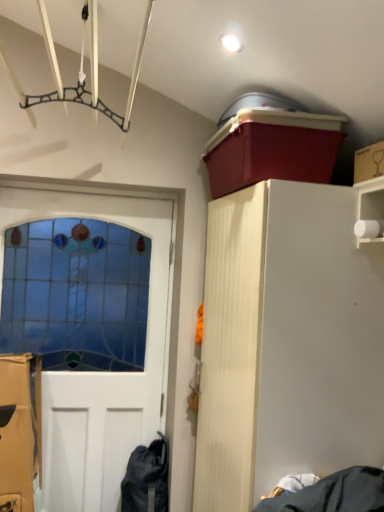
The height and width of the screenshot is (512, 384). I want to click on white wood cabinet at upper right, so click(287, 342).

Find the location of a particular element. door that is below the cardboard box at upper right (from the image's perspective) is located at coordinates (82, 341).

From the image's perspective, is stained glass door at left above or below cardboard box at upper right?

Clearly, from the image's perspective, stained glass door at left is below cardboard box at upper right.

Considering the positions of objects stained glass door at left and cardboard box at upper right in the image provided, who is in front, stained glass door at left or cardboard box at upper right?

cardboard box at upper right.

How much distance is there between stained glass door at left and cardboard box at upper right?

stained glass door at left is 1.44 meters away from cardboard box at upper right.

Looking at their sizes, would you say matte plastic storage bin at upper right is wider or thinner than white wood cabinet at upper right?

matte plastic storage bin at upper right is thinner than white wood cabinet at upper right.

In the image, is matte plastic storage bin at upper right on the left side or the right side of white wood cabinet at upper right?

In the image, matte plastic storage bin at upper right appears on the left side of white wood cabinet at upper right.

Locate an element on the screen. This screenshot has height=512, width=384. box above the white wood cabinet at upper right (from a real-world perspective) is located at coordinates (272, 149).

Are matte plastic storage bin at upper right and white wood cabinet at upper right beside each other?

No, matte plastic storage bin at upper right is not beside white wood cabinet at upper right.

Is cardboard box at upper right directly adjacent to stained glass door at left?

No, cardboard box at upper right is not next to stained glass door at left.

Does cardboard box at upper right turn towards stained glass door at left?

No, cardboard box at upper right is not aimed at stained glass door at left.

From a real-world perspective, is cardboard box at upper right located higher than stained glass door at left?

Correct, in the physical world, cardboard box at upper right is higher than stained glass door at left.

Does cardboard box at upper right have a lesser height compared to stained glass door at left?

Indeed, cardboard box at upper right has a lesser height compared to stained glass door at left.

From the picture: From the image's perspective, which one is positioned higher, white wood cabinet at upper right or matte plastic storage bin at upper right?

matte plastic storage bin at upper right.

Is white wood cabinet at upper right turned away from matte plastic storage bin at upper right?

No, white wood cabinet at upper right is not facing the opposite direction of matte plastic storage bin at upper right.

From the picture: From a real-world perspective, is white wood cabinet at upper right positioned under matte plastic storage bin at upper right based on gravity?

Yes, from a real-world perspective, white wood cabinet at upper right is beneath matte plastic storage bin at upper right.

How much distance is there between white wood cabinet at upper right and matte plastic storage bin at upper right?

A distance of 37.55 centimeters exists between white wood cabinet at upper right and matte plastic storage bin at upper right.

Can you confirm if cardboard box at upper right is bigger than matte plastic storage bin at upper right?

No, cardboard box at upper right is not bigger than matte plastic storage bin at upper right.

Where is `box above the cardboard box at upper right (from the image's perspective)`? This screenshot has height=512, width=384. box above the cardboard box at upper right (from the image's perspective) is located at coordinates (272, 149).

Could matte plastic storage bin at upper right be considered to be inside cardboard box at upper right?

No, matte plastic storage bin at upper right is not inside cardboard box at upper right.

Consider the image. Considering the sizes of objects cardboard box at upper right and matte plastic storage bin at upper right in the image provided, who is shorter, cardboard box at upper right or matte plastic storage bin at upper right?

cardboard box at upper right.

This screenshot has height=512, width=384. In order to click on cardboard box located on the right of white wood cabinet at upper right in this screenshot , I will do `click(369, 162)`.

Does point (366, 154) appear closer or farther from the camera than point (294, 243)?

Point (366, 154) is positioned farther from the camera compared to point (294, 243).

Would you say cardboard box at upper right is to the left or to the right of white wood cabinet at upper right in the picture?

From the image, it's evident that cardboard box at upper right is to the right of white wood cabinet at upper right.

Is stained glass door at left turned away from white wood cabinet at upper right?

No, stained glass door at left's orientation is not away from white wood cabinet at upper right.

Which is more to the left, stained glass door at left or white wood cabinet at upper right?

stained glass door at left is more to the left.

From a real-world perspective, is stained glass door at left physically below white wood cabinet at upper right?

Indeed, from a real-world perspective, stained glass door at left is positioned beneath white wood cabinet at upper right.

The height and width of the screenshot is (512, 384). I want to click on door that appears behind the cardboard box at upper right, so click(x=82, y=341).

Image resolution: width=384 pixels, height=512 pixels. Identify the location of box that appears above the white wood cabinet at upper right (from the image's perspective). (272, 149).

Based on their spatial positions, is cardboard box at upper right or white wood cabinet at upper right closer to matte plastic storage bin at upper right?

Among the two, cardboard box at upper right is located nearer to matte plastic storage bin at upper right.

Considering their positions, is white wood cabinet at upper right positioned further to cardboard box at upper right than stained glass door at left?

Based on the image, stained glass door at left appears to be further to cardboard box at upper right.

When comparing their distances from cardboard box at upper right, does white wood cabinet at upper right or matte plastic storage bin at upper right seem further?

white wood cabinet at upper right is positioned further to the anchor cardboard box at upper right.

When comparing their distances from stained glass door at left, does cardboard box at upper right or matte plastic storage bin at upper right seem further?

cardboard box at upper right lies further to stained glass door at left than the other object.

Based on their spatial positions, is stained glass door at left or cardboard box at upper right closer to matte plastic storage bin at upper right?

cardboard box at upper right.

From the image, which object appears to be nearer to stained glass door at left, white wood cabinet at upper right or matte plastic storage bin at upper right?

white wood cabinet at upper right.

Looking at this image, estimate the real-world distances between objects in this image. Which object is closer to matte plastic storage bin at upper right, white wood cabinet at upper right or stained glass door at left?

white wood cabinet at upper right is positioned closer to the anchor matte plastic storage bin at upper right.

From the image, which object appears to be farther from white wood cabinet at upper right, cardboard box at upper right or stained glass door at left?

stained glass door at left.

Where is `box between stained glass door at left and cardboard box at upper right from left to right`? Image resolution: width=384 pixels, height=512 pixels. box between stained glass door at left and cardboard box at upper right from left to right is located at coordinates (272, 149).

Where is `box between stained glass door at left and white wood cabinet at upper right in the horizontal direction`? box between stained glass door at left and white wood cabinet at upper right in the horizontal direction is located at coordinates (272, 149).

I want to click on cardboard box that lies between matte plastic storage bin at upper right and white wood cabinet at upper right from top to bottom, so click(x=369, y=162).

Locate an element on the screen. The image size is (384, 512). cabinetry between stained glass door at left and cardboard box at upper right is located at coordinates (287, 342).